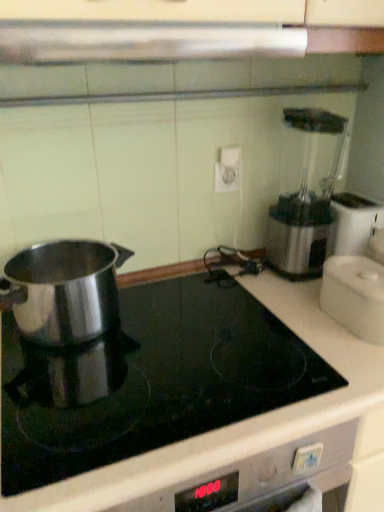
Question: Is satin silver exhaust hood at upper center further to camera compared to white plastic container at right, which is counted as the first kitchen appliance, starting from the right?

Choices:
 (A) no
 (B) yes

Answer: (A)

Question: Is satin silver exhaust hood at upper center beside white plastic container at right, the third kitchen appliance viewed from the left?

Choices:
 (A) yes
 (B) no

Answer: (B)

Question: Is satin silver exhaust hood at upper center bigger than white plastic container at right, the third kitchen appliance viewed from the left?

Choices:
 (A) yes
 (B) no

Answer: (A)

Question: From a real-world perspective, is satin silver exhaust hood at upper center below white plastic container at right, the third kitchen appliance viewed from the left?

Choices:
 (A) no
 (B) yes

Answer: (A)

Question: Considering the relative positions of satin silver exhaust hood at upper center and white plastic container at right, which is counted as the first kitchen appliance, starting from the right, in the image provided, is satin silver exhaust hood at upper center in front of white plastic container at right, which is counted as the first kitchen appliance, starting from the right,?

Choices:
 (A) no
 (B) yes

Answer: (B)

Question: Is satin silver exhaust hood at upper center to the left of white plastic container at right, the third kitchen appliance viewed from the left, from the viewer's perspective?

Choices:
 (A) yes
 (B) no

Answer: (A)

Question: Is polished stainless steel pot at left, which appears as the 2th kitchen appliance when viewed from the left, with polished stainless steel pot at left, arranged as the third kitchen appliance when viewed from the right?

Choices:
 (A) no
 (B) yes

Answer: (A)

Question: Could you tell me if polished stainless steel pot at left, which appears as the 2th kitchen appliance when viewed from the left, is facing polished stainless steel pot at left, arranged as the third kitchen appliance when viewed from the right?

Choices:
 (A) yes
 (B) no

Answer: (B)

Question: From the image's perspective, is polished stainless steel pot at left, which appears as the 2th kitchen appliance when viewed from the left, below polished stainless steel pot at left, arranged as the third kitchen appliance when viewed from the right?

Choices:
 (A) yes
 (B) no

Answer: (A)

Question: Would you say polished stainless steel pot at left, arranged as the 1th kitchen appliance when viewed from the left, is part of polished stainless steel pot at left, which appears as the 2th kitchen appliance when viewed from the left,'s contents?

Choices:
 (A) no
 (B) yes

Answer: (A)

Question: Can you confirm if polished stainless steel pot at left, which appears as the 2th kitchen appliance when viewed from the left, is positioned to the right of polished stainless steel pot at left, arranged as the 1th kitchen appliance when viewed from the left?

Choices:
 (A) no
 (B) yes

Answer: (B)

Question: From a real-world perspective, is polished stainless steel pot at left, arranged as the 2th kitchen appliance when viewed from the right, physically below polished stainless steel pot at left, arranged as the third kitchen appliance when viewed from the right?

Choices:
 (A) no
 (B) yes

Answer: (B)

Question: Does satin silver exhaust hood at upper center come behind polished stainless steel pot at left, arranged as the 1th kitchen appliance when viewed from the left?

Choices:
 (A) yes
 (B) no

Answer: (B)